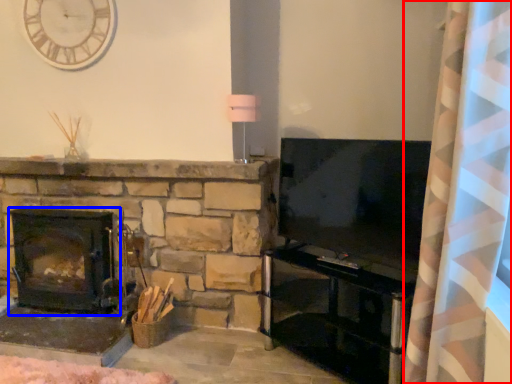
Question: Which object appears closest to the camera in this image, curtain (highlighted by a red box) or wood burning stove (highlighted by a blue box)?

Choices:
 (A) curtain
 (B) wood burning stove

Answer: (A)